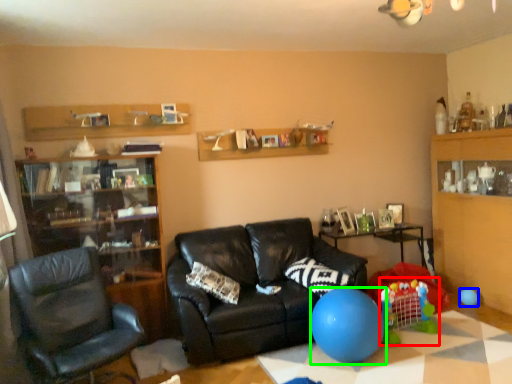
Question: Considering the real-world distances, which object is farthest from toy (highlighted by a red box)? balloon (highlighted by a blue box) or balloon (highlighted by a green box)?

Choices:
 (A) balloon
 (B) balloon

Answer: (A)